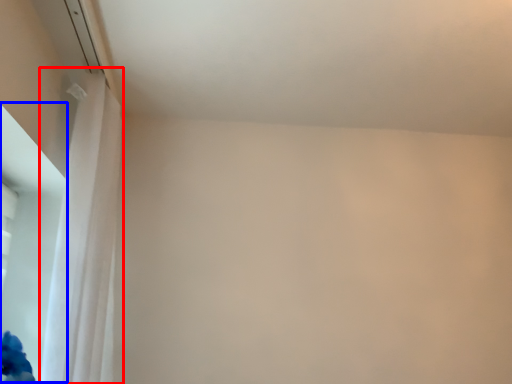
Question: Among these objects, which one is farthest to the camera, curtain (highlighted by a red box) or window screen (highlighted by a blue box)?

Choices:
 (A) curtain
 (B) window screen

Answer: (B)